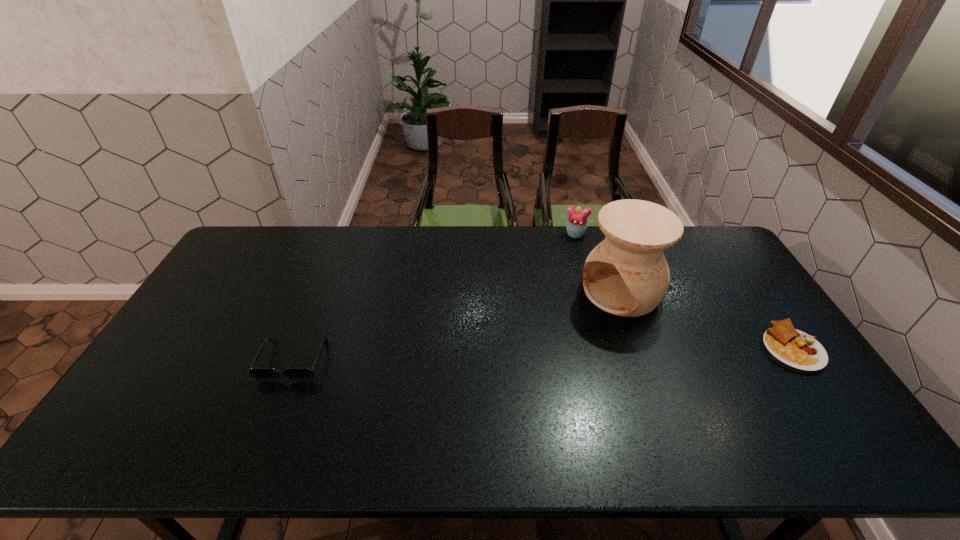
This screenshot has width=960, height=540. In order to click on free location located on the face of the cupcake in this screenshot , I will do `click(560, 293)`.

Locate an element on the screen. The height and width of the screenshot is (540, 960). vacant point located 0.330m on the face of the cupcake is located at coordinates (559, 299).

Image resolution: width=960 pixels, height=540 pixels. Identify the location of vacant point located on the face of the cupcake. (569, 251).

The image size is (960, 540). What are the coordinates of `free space located at the open side of the third nearest object` in the screenshot? It's located at (574, 326).

Locate an element on the screen. vacant space located 0.130m at the open side of the third nearest object is located at coordinates (567, 330).

Identify the location of free space located at the open side of the third nearest object. The width and height of the screenshot is (960, 540). (561, 335).

The height and width of the screenshot is (540, 960). Find the location of `object at the far edge`. object at the far edge is located at coordinates (576, 226).

The width and height of the screenshot is (960, 540). In order to click on object positioned at the right edge in this screenshot , I will do pyautogui.click(x=791, y=348).

At what (x,y) coordinates should I click in order to perform the action: click on free region at the far edge of the desktop. Please return your answer as a coordinate pair (x, y). Image resolution: width=960 pixels, height=540 pixels. Looking at the image, I should click on (323, 227).

In the image, there is a desktop. Where is `free space at the near edge`? Image resolution: width=960 pixels, height=540 pixels. free space at the near edge is located at coordinates (569, 393).